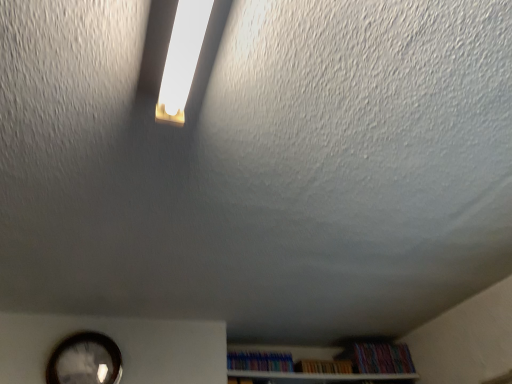
This screenshot has width=512, height=384. What are the coordinates of `multicolored plastic books at lower center, arranged as the third book when viewed from the right` in the screenshot? It's located at (260, 361).

In order to click on multicolored plastic books at lower center, arranged as the third book when viewed from the right in this screenshot , I will do `click(260, 361)`.

Is multicolored paperbacks at lower right, which appears as the 3th book when viewed from the left, situated inside white wooden shelf at lower center or outside?

multicolored paperbacks at lower right, which appears as the 3th book when viewed from the left, cannot be found inside white wooden shelf at lower center.

Considering the relative positions of multicolored paperbacks at lower right, which appears as the 3th book when viewed from the left, and white wooden shelf at lower center in the image provided, is multicolored paperbacks at lower right, which appears as the 3th book when viewed from the left, to the right of white wooden shelf at lower center from the viewer's perspective?

Indeed, multicolored paperbacks at lower right, which appears as the 3th book when viewed from the left, is positioned on the right side of white wooden shelf at lower center.

Considering their positions, is multicolored paperbacks at lower right, which appears as the 3th book when viewed from the left, located in front of or behind white wooden shelf at lower center?

multicolored paperbacks at lower right, which appears as the 3th book when viewed from the left, is behind white wooden shelf at lower center.

Considering the relative sizes of matte black clock at lower left and multicolored paperbacks at lower right, positioned as the 1th book in right-to-left order, in the image provided, is matte black clock at lower left smaller than multicolored paperbacks at lower right, positioned as the 1th book in right-to-left order,?

A: Correct, matte black clock at lower left occupies less space than multicolored paperbacks at lower right, positioned as the 1th book in right-to-left order.

Which is in front, point (91, 341) or point (392, 366)?

The point (91, 341) is in front.

From the image's perspective, does matte black clock at lower left appear lower than multicolored paperbacks at lower right, which appears as the 3th book when viewed from the left?

No, from the image's perspective, matte black clock at lower left is not beneath multicolored paperbacks at lower right, which appears as the 3th book when viewed from the left.

Consider the image. How many degrees apart are the facing directions of multicolored plastic books at lower center, the 1th book from the left, and wooden bookshelf at lower center, marked as the 2th book in a right-to-left arrangement?

4.11 degrees separate the facing orientations of multicolored plastic books at lower center, the 1th book from the left, and wooden bookshelf at lower center, marked as the 2th book in a right-to-left arrangement.

Is multicolored plastic books at lower center, arranged as the third book when viewed from the right, positioned far away from wooden bookshelf at lower center, marked as the 2th book in a right-to-left arrangement?

No, multicolored plastic books at lower center, arranged as the third book when viewed from the right, is not far away from wooden bookshelf at lower center, marked as the 2th book in a right-to-left arrangement.

Which book is the 1st one when counting from the right side of the multicolored plastic books at lower center, the 1th book from the left? Please provide its 2D coordinates.

[(323, 366)]

From the image's perspective, is multicolored plastic books at lower center, arranged as the third book when viewed from the right, located above wooden bookshelf at lower center, marked as the second book in a left-to-right arrangement?

Yes, from the image's perspective, multicolored plastic books at lower center, arranged as the third book when viewed from the right, is above wooden bookshelf at lower center, marked as the second book in a left-to-right arrangement.

How much distance is there between matte black clock at lower left and white wooden shelf at lower center?

matte black clock at lower left and white wooden shelf at lower center are 32.37 inches apart.

Considering the sizes of objects matte black clock at lower left and white wooden shelf at lower center in the image provided, who is shorter, matte black clock at lower left or white wooden shelf at lower center?

white wooden shelf at lower center.

How different are the orientations of matte black clock at lower left and white wooden shelf at lower center in degrees?

They differ by 1.49 degrees in their facing directions.

Consider the image. Between matte black clock at lower left and white wooden shelf at lower center, which one has larger width?

Wider between the two is white wooden shelf at lower center.

Based on their positions, is multicolored paperbacks at lower right, positioned as the 1th book in right-to-left order, located to the left or right of multicolored plastic books at lower center, the 1th book from the left?

multicolored paperbacks at lower right, positioned as the 1th book in right-to-left order, is positioned on multicolored plastic books at lower center, the 1th book from the left,'s right side.

The image size is (512, 384). Identify the location of the 2nd book to the right of the multicolored plastic books at lower center, arranged as the third book when viewed from the right, counting from the anchor's position. (382, 358).

Which is closer, (364, 365) or (277, 355)?

Clearly, point (364, 365) is closer to the camera than point (277, 355).

Is multicolored paperbacks at lower right, positioned as the 1th book in right-to-left order, far from multicolored plastic books at lower center, the 1th book from the left?

Actually, multicolored paperbacks at lower right, positioned as the 1th book in right-to-left order, and multicolored plastic books at lower center, the 1th book from the left, are a little close together.

Measure the distance between multicolored plastic books at lower center, the 1th book from the left, and multicolored paperbacks at lower right, which appears as the 3th book when viewed from the left.

A distance of 22.70 inches exists between multicolored plastic books at lower center, the 1th book from the left, and multicolored paperbacks at lower right, which appears as the 3th book when viewed from the left.

Consider the image. From a real-world perspective, between multicolored plastic books at lower center, the 1th book from the left, and multicolored paperbacks at lower right, positioned as the 1th book in right-to-left order, who is vertically lower?

multicolored plastic books at lower center, the 1th book from the left.

Could you tell me if multicolored plastic books at lower center, the 1th book from the left, is turned towards multicolored paperbacks at lower right, which appears as the 3th book when viewed from the left?

Answer: No, multicolored plastic books at lower center, the 1th book from the left, is not turned towards multicolored paperbacks at lower right, which appears as the 3th book when viewed from the left.

Looking at this image, which is more to the right, multicolored plastic books at lower center, arranged as the third book when viewed from the right, or multicolored paperbacks at lower right, which appears as the 3th book when viewed from the left?

From the viewer's perspective, multicolored paperbacks at lower right, which appears as the 3th book when viewed from the left, appears more on the right side.

From a real-world perspective, who is located higher, matte black clock at lower left or multicolored plastic books at lower center, arranged as the third book when viewed from the right?

multicolored plastic books at lower center, arranged as the third book when viewed from the right.

Where is `clock in front of the multicolored plastic books at lower center, the 1th book from the left`? This screenshot has width=512, height=384. clock in front of the multicolored plastic books at lower center, the 1th book from the left is located at coordinates (85, 360).

In terms of height, does matte black clock at lower left look taller or shorter compared to multicolored plastic books at lower center, arranged as the third book when viewed from the right?

Clearly, matte black clock at lower left is taller compared to multicolored plastic books at lower center, arranged as the third book when viewed from the right.

Looking at this image, how much distance is there between matte black clock at lower left and multicolored plastic books at lower center, the 1th book from the left?

The distance of matte black clock at lower left from multicolored plastic books at lower center, the 1th book from the left, is 31.06 inches.

You are a GUI agent. You are given a task and a screenshot of the screen. Output one action in this format:
    pyautogui.click(x=<x>, y=<y>)
    Task: Click on the shelf that appears below the multicolored paperbacks at lower right, which appears as the 3th book when viewed from the left (from the image's perspective)
    Image resolution: width=512 pixels, height=384 pixels.
    Given the screenshot: What is the action you would take?
    pyautogui.click(x=318, y=376)

Locate an element on the screen. This screenshot has height=384, width=512. clock that is above the multicolored paperbacks at lower right, positioned as the 1th book in right-to-left order (from the image's perspective) is located at coordinates (85, 360).

Which object lies nearer to the anchor point white wooden shelf at lower center, multicolored plastic books at lower center, arranged as the third book when viewed from the right, or matte black clock at lower left?

The object closer to white wooden shelf at lower center is multicolored plastic books at lower center, arranged as the third book when viewed from the right.

Estimate the real-world distances between objects in this image. Which object is further from wooden bookshelf at lower center, marked as the second book in a left-to-right arrangement, multicolored plastic books at lower center, the 1th book from the left, or multicolored paperbacks at lower right, which appears as the 3th book when viewed from the left?

multicolored plastic books at lower center, the 1th book from the left, lies further to wooden bookshelf at lower center, marked as the second book in a left-to-right arrangement, than the other object.

Considering their positions, is multicolored plastic books at lower center, arranged as the third book when viewed from the right, positioned further to matte black clock at lower left than multicolored paperbacks at lower right, which appears as the 3th book when viewed from the left?

multicolored paperbacks at lower right, which appears as the 3th book when viewed from the left, lies further to matte black clock at lower left than the other object.

From the image, which object appears to be nearer to wooden bookshelf at lower center, marked as the 2th book in a right-to-left arrangement, white wooden shelf at lower center or multicolored paperbacks at lower right, positioned as the 1th book in right-to-left order?

multicolored paperbacks at lower right, positioned as the 1th book in right-to-left order, is closer to wooden bookshelf at lower center, marked as the 2th book in a right-to-left arrangement.

From the image, which object appears to be nearer to wooden bookshelf at lower center, marked as the second book in a left-to-right arrangement, matte black clock at lower left or white wooden shelf at lower center?

Based on the image, white wooden shelf at lower center appears to be nearer to wooden bookshelf at lower center, marked as the second book in a left-to-right arrangement.

Considering their positions, is matte black clock at lower left positioned further to white wooden shelf at lower center than wooden bookshelf at lower center, marked as the 2th book in a right-to-left arrangement?

The object further to white wooden shelf at lower center is matte black clock at lower left.

From the image, which object appears to be farther from multicolored paperbacks at lower right, which appears as the 3th book when viewed from the left, multicolored plastic books at lower center, arranged as the third book when viewed from the right, or white wooden shelf at lower center?

multicolored plastic books at lower center, arranged as the third book when viewed from the right, is positioned further to the anchor multicolored paperbacks at lower right, which appears as the 3th book when viewed from the left.

Looking at the image, which one is located further to wooden bookshelf at lower center, marked as the 2th book in a right-to-left arrangement, multicolored plastic books at lower center, the 1th book from the left, or white wooden shelf at lower center?

multicolored plastic books at lower center, the 1th book from the left, is further to wooden bookshelf at lower center, marked as the 2th book in a right-to-left arrangement.

Find the location of a particular element. Image resolution: width=512 pixels, height=384 pixels. book between multicolored plastic books at lower center, arranged as the third book when viewed from the right, and multicolored paperbacks at lower right, positioned as the 1th book in right-to-left order, in the horizontal direction is located at coordinates (323, 366).

Locate an element on the screen. Image resolution: width=512 pixels, height=384 pixels. shelf situated between matte black clock at lower left and wooden bookshelf at lower center, marked as the second book in a left-to-right arrangement, from left to right is located at coordinates (318, 376).

This screenshot has height=384, width=512. I want to click on shelf situated between multicolored plastic books at lower center, the 1th book from the left, and wooden bookshelf at lower center, marked as the second book in a left-to-right arrangement, from left to right, so click(318, 376).

The width and height of the screenshot is (512, 384). In order to click on shelf between matte black clock at lower left and multicolored paperbacks at lower right, which appears as the 3th book when viewed from the left in this screenshot , I will do `click(318, 376)`.